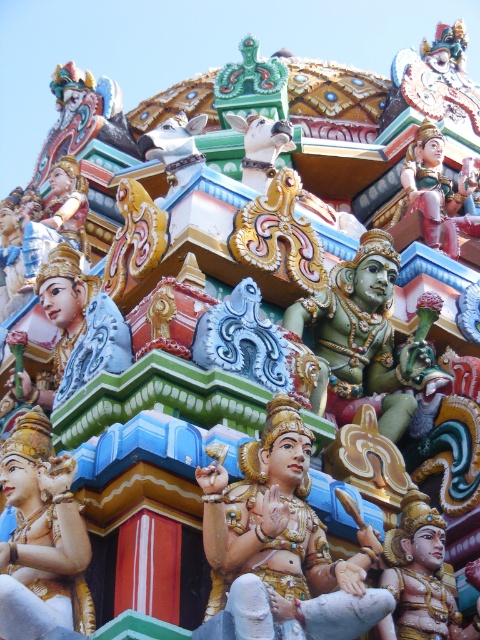
Question: Does polished gold statue at center appear over matte gold statue at center?

Choices:
 (A) yes
 (B) no

Answer: (B)

Question: Which is nearer to the matte gold statue at center?

Choices:
 (A) green polished statue at center
 (B) gold polished statue at center

Answer: (A)

Question: Is polished gold statue at center smaller than green polished statue at center?

Choices:
 (A) no
 (B) yes

Answer: (A)

Question: Which point is closer to the camera?

Choices:
 (A) (19, 481)
 (B) (73, 266)
 (C) (323, 314)

Answer: (A)

Question: Does gold polished statue at center come behind green polished statue at center?

Choices:
 (A) no
 (B) yes

Answer: (A)

Question: Which is farther from the matte gold statue at center?

Choices:
 (A) gold polished statue at center
 (B) polished gold statue at center
 (C) green polished statue at center

Answer: (B)